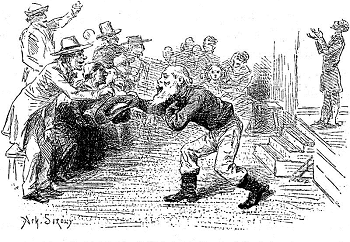
Locate an element on the screen. This screenshot has height=242, width=350. stage is located at coordinates (333, 142).